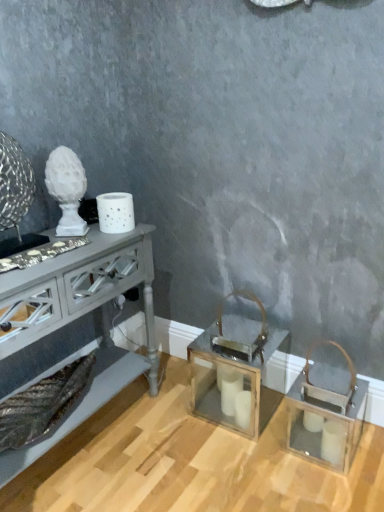
Identify the location of vacant point above matte gray console table at left, acting as the second table starting from the right (from a real-world perspective). (56, 250).